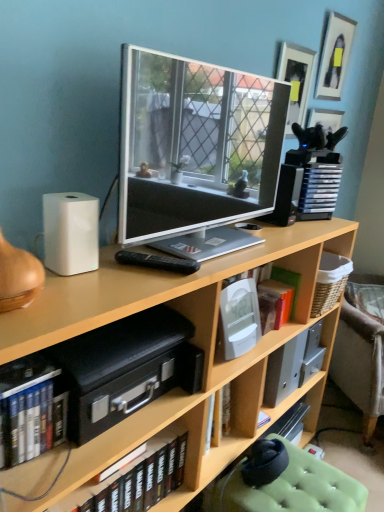
Where is `vacant space that's between black plastic remote at center and white matte speaker at left, the 2th speaker from the top`? This screenshot has height=512, width=384. vacant space that's between black plastic remote at center and white matte speaker at left, the 2th speaker from the top is located at coordinates (127, 270).